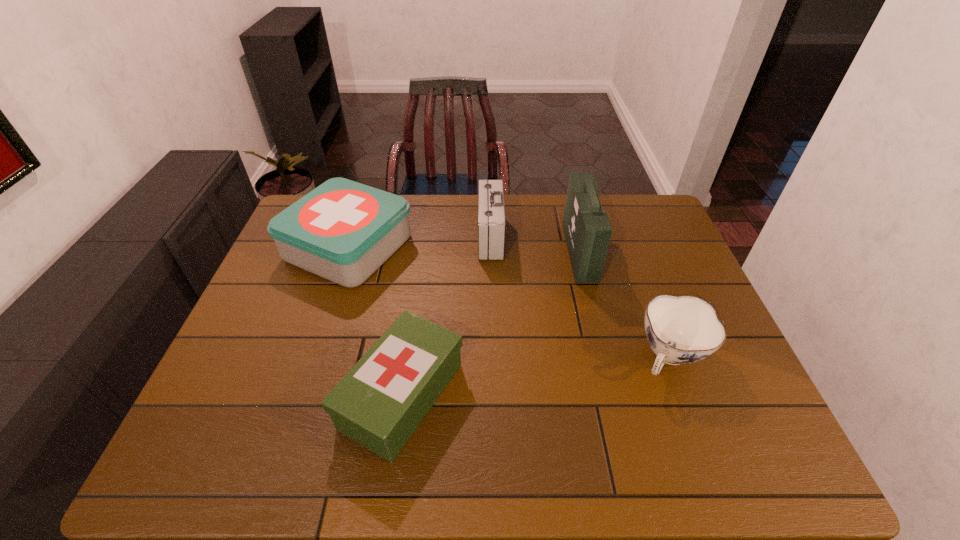
This screenshot has width=960, height=540. Identify the location of free space that is in between the tallest object and the third object from right to left. [535, 244].

Locate an element on the screen. The height and width of the screenshot is (540, 960). vacant space in between the nearest first-aid kit and the rightmost first-aid kit is located at coordinates (491, 323).

You are a GUI agent. You are given a task and a screenshot of the screen. Output one action in this format:
    pyautogui.click(x=<x>, y=<y>)
    Task: Click on the unoccupied area between the shortest first-aid kit and the tallest first-aid kit
    This screenshot has height=540, width=960.
    Given the screenshot: What is the action you would take?
    pyautogui.click(x=491, y=323)

Find the location of a particular element. The width and height of the screenshot is (960, 540). free space between the tallest object and the third first-aid kit from left to right is located at coordinates (535, 244).

Find the location of a particular element. vacant area between the shortest first-aid kit and the rightmost first-aid kit is located at coordinates (491, 323).

The width and height of the screenshot is (960, 540). Find the location of `free space between the third object from left to right and the rightmost object`. free space between the third object from left to right and the rightmost object is located at coordinates (580, 297).

Where is `the third closest object to the shortest first-aid kit`? This screenshot has width=960, height=540. the third closest object to the shortest first-aid kit is located at coordinates (587, 229).

Locate which object is the closest to the third object from left to right. Please provide its 2D coordinates. Your answer should be formatted as a tuple, i.e. [(x, y)], where the tuple contains the x and y coordinates of a point satisfying the conditions above.

[(587, 229)]

Locate which first-aid kit is the closest to the third object from left to right. Please provide its 2D coordinates. Your answer should be formatted as a tuple, i.e. [(x, y)], where the tuple contains the x and y coordinates of a point satisfying the conditions above.

[(587, 229)]

Identify which first-aid kit is the nearest to the third object from left to right. Please provide its 2D coordinates. Your answer should be formatted as a tuple, i.e. [(x, y)], where the tuple contains the x and y coordinates of a point satisfying the conditions above.

[(587, 229)]